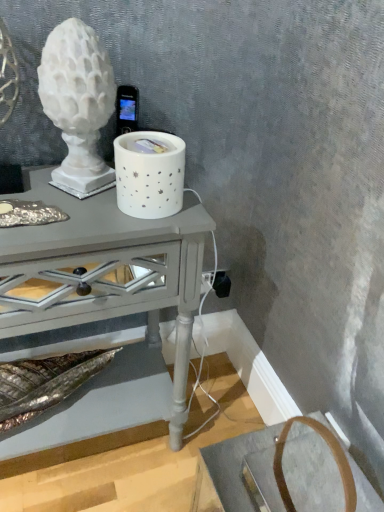
Find the location of a particular element. vacant space in front of white matte sculpture at upper left, the first candle holder when ordered from left to right is located at coordinates (76, 225).